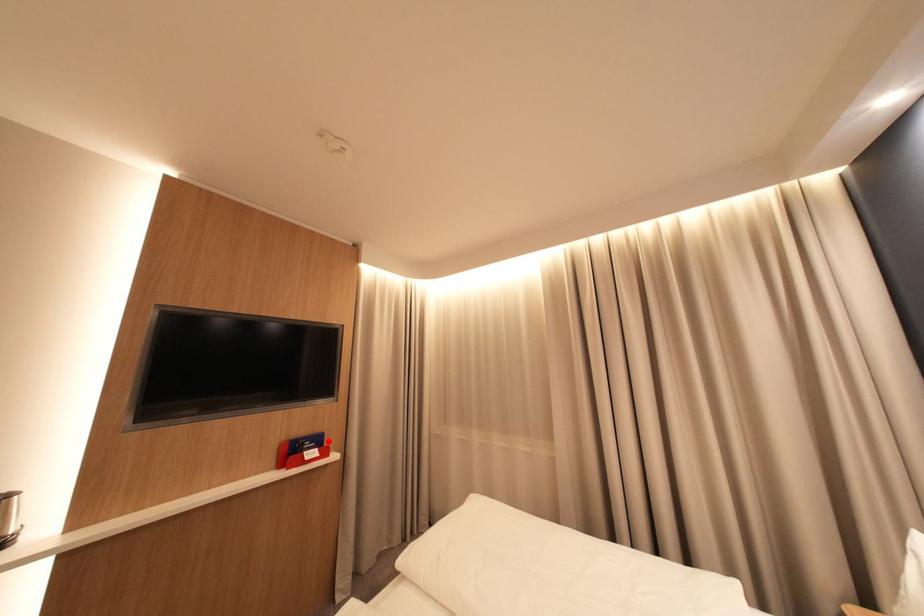
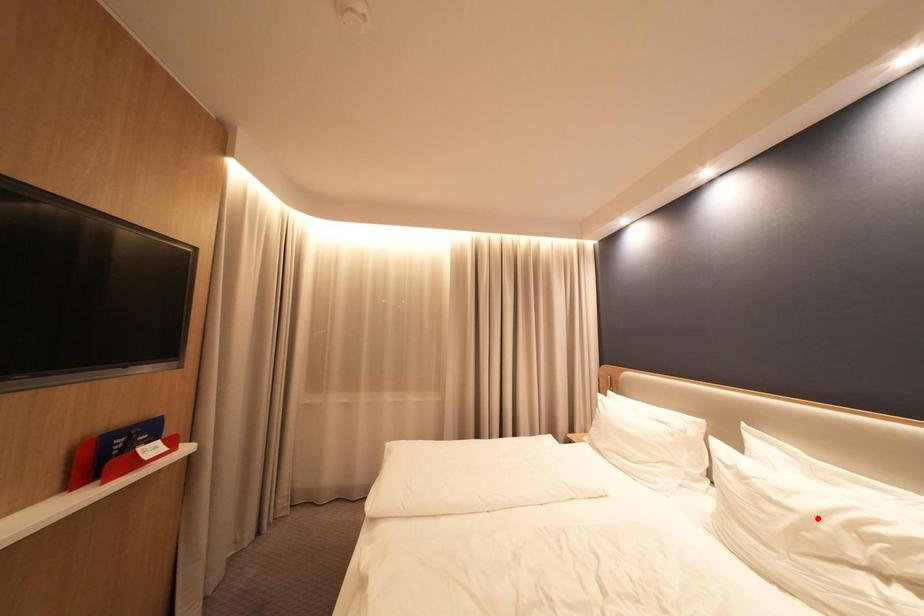
I am providing you with two images of the same scene from different viewpoints. A red point is marked on the first image and another point is marked on the second image. Is the marked point in image1 the same physical position as the marked point in image2?

No